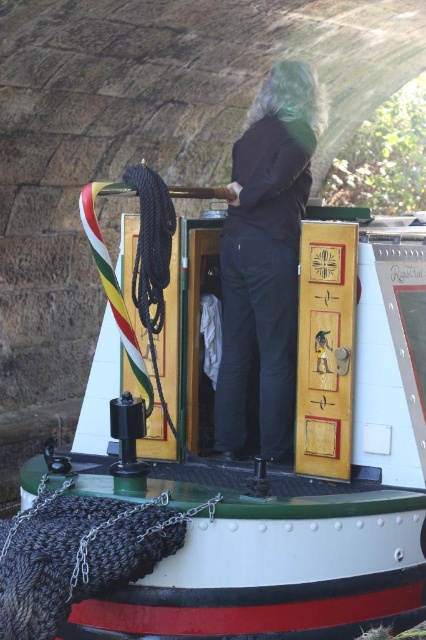
Question: Is white glossy boat at center to the left of dark blue jeans at center from the viewer's perspective?

Choices:
 (A) no
 (B) yes

Answer: (B)

Question: Which object appears farthest from the camera in this image?

Choices:
 (A) white glossy boat at center
 (B) dark blue jeans at center

Answer: (B)

Question: Which point appears closest to the camera in this image?

Choices:
 (A) (328, 440)
 (B) (282, 262)

Answer: (A)

Question: Can you confirm if white glossy boat at center is thinner than dark blue jeans at center?

Choices:
 (A) yes
 (B) no

Answer: (B)

Question: Is white glossy boat at center below dark blue jeans at center?

Choices:
 (A) yes
 (B) no

Answer: (A)

Question: Which of the following is the closest to the observer?

Choices:
 (A) (284, 97)
 (B) (109, 429)

Answer: (A)